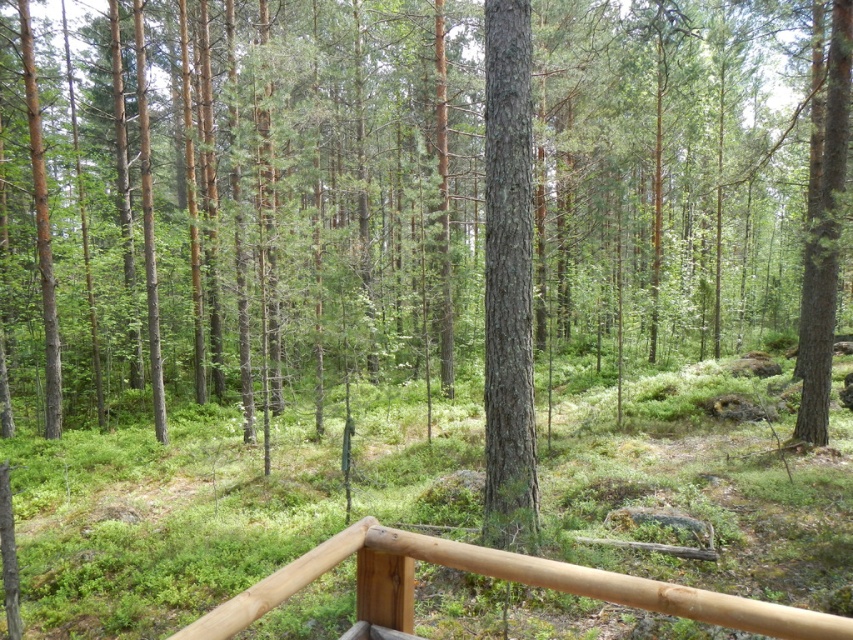
Can you confirm if smooth bark tree at center is positioned to the left of smooth bark tree at right?

Indeed, smooth bark tree at center is positioned on the left side of smooth bark tree at right.

Between smooth bark tree at center and smooth bark tree at right, which one is positioned lower?

smooth bark tree at center is below.

This screenshot has height=640, width=853. What do you see at coordinates (508, 280) in the screenshot?
I see `smooth bark tree at center` at bounding box center [508, 280].

Find the location of a particular element. This screenshot has height=640, width=853. smooth bark tree at center is located at coordinates (508, 280).

You are a GUI agent. You are given a task and a screenshot of the screen. Output one action in this format:
    pyautogui.click(x=<x>, y=<y>)
    Task: Click on the smooth bark tree at center
    
    Given the screenshot: What is the action you would take?
    pyautogui.click(x=508, y=280)

Between smooth bark tree at center and brown wooden rail at center, which one appears on the left side from the viewer's perspective?

Positioned to the left is brown wooden rail at center.

Where is `smooth bark tree at center`? The image size is (853, 640). smooth bark tree at center is located at coordinates pos(508,280).

Does brown wooden rail at center have a lesser width compared to smooth bark tree at right?

In fact, brown wooden rail at center might be wider than smooth bark tree at right.

Can you confirm if brown wooden rail at center is positioned to the left of smooth bark tree at right?

Yes, brown wooden rail at center is to the left of smooth bark tree at right.

Is point (355, 525) farther from camera compared to point (820, 289)?

No, (355, 525) is in front of (820, 289).

Locate an element on the screen. brown wooden rail at center is located at coordinates (492, 577).